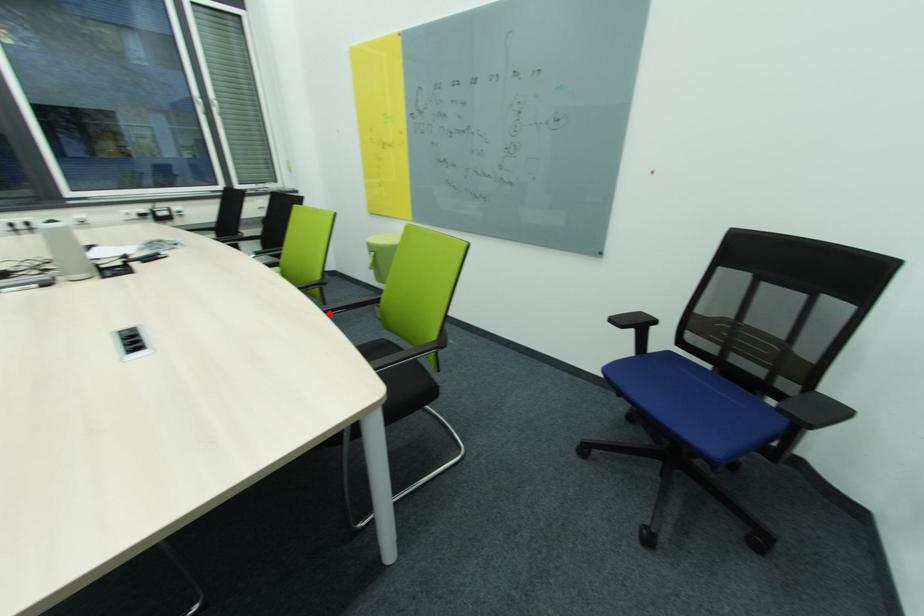
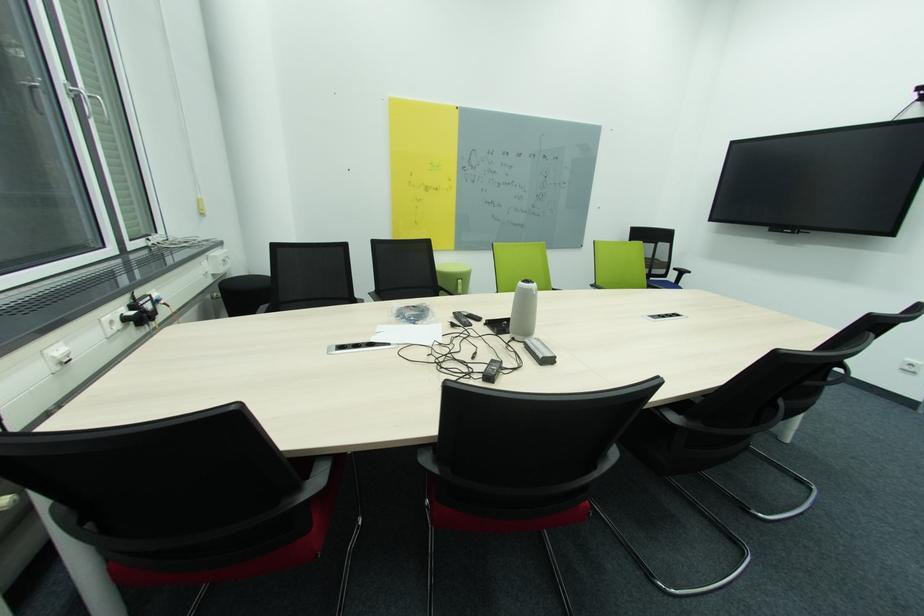
Question: I am providing you with two images of the same scene from different viewpoints. A red point is marked on the first image. At the location where the point appears in image 1, is it still visible in image 2?

Choices:
 (A) Yes
 (B) No

Answer: (B)